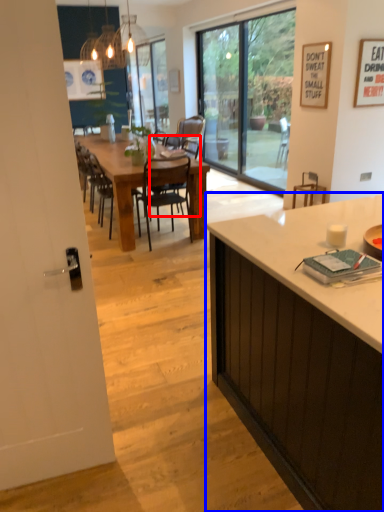
Question: Which of the following is the farthest to the observer, chair (highlighted by a red box) or cabinetry (highlighted by a blue box)?

Choices:
 (A) chair
 (B) cabinetry

Answer: (A)